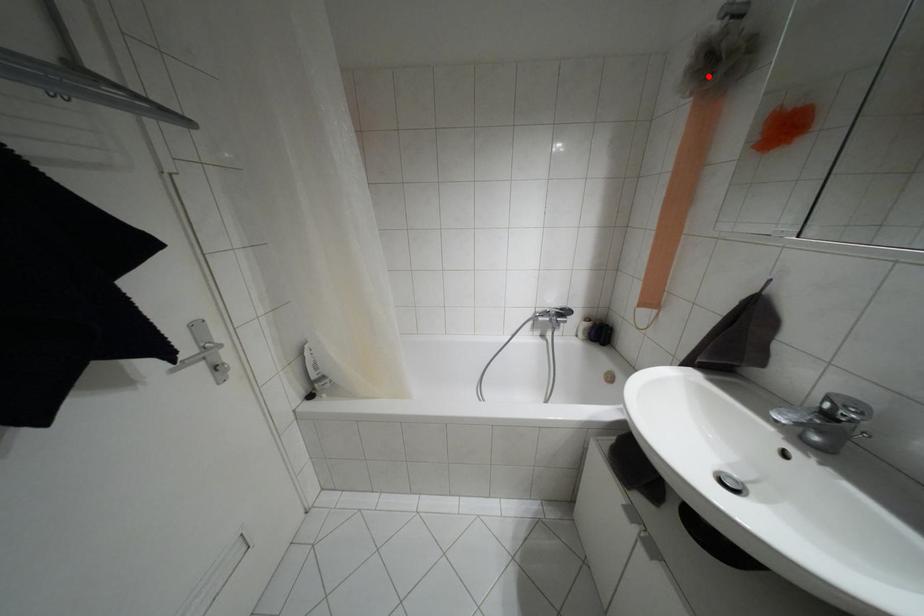
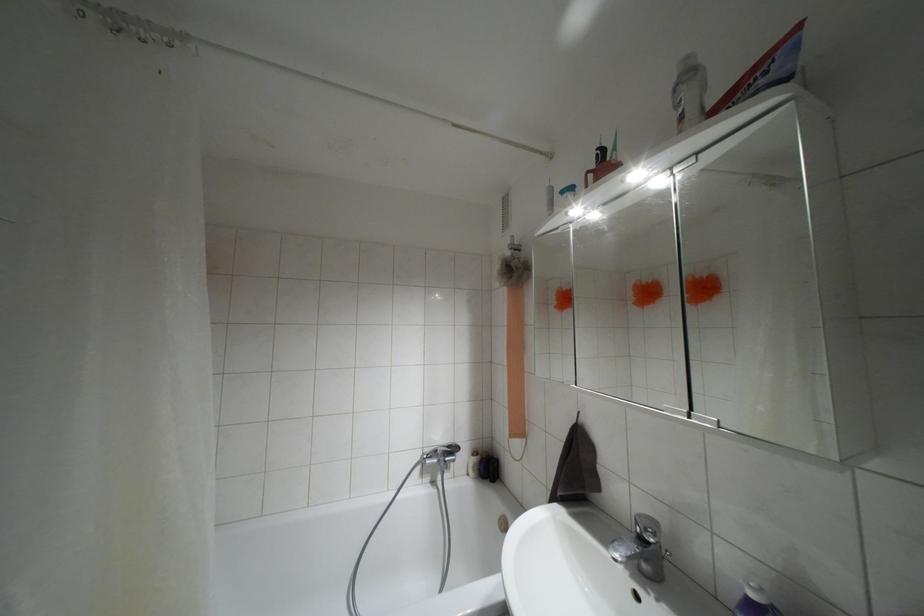
In the second image, find the point that corresponds to the highlighted location in the first image.

(509, 277)